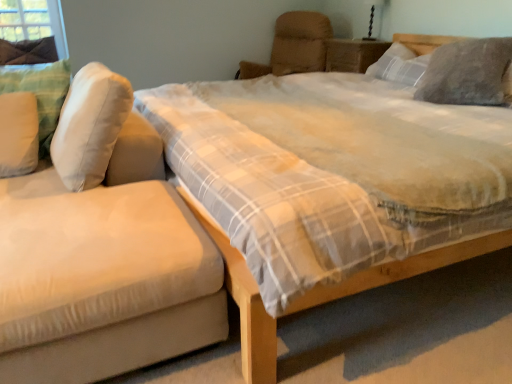
Question: From the image's perspective, is black glass table lamp at upper right positioned above or below gray fuzzy pillow at upper right, the 1th pillow positioned from the right?

Choices:
 (A) below
 (B) above

Answer: (B)

Question: Is black glass table lamp at upper right inside or outside of gray fuzzy pillow at upper right, the 1th pillow positioned from the right?

Choices:
 (A) inside
 (B) outside

Answer: (B)

Question: Which object is positioned farthest from the beige fabric armchair at upper center?

Choices:
 (A) black glass table lamp at upper right
 (B) white soft pillow at left, positioned as the first pillow in left-to-right order
 (C) wooden nightstand at upper center
 (D) white fabric pillow at left, the third pillow from the right
 (E) suede-like beige studio couch at left

Answer: (E)

Question: Which of these objects is positioned farthest from the velvet beige bed at center?

Choices:
 (A) white soft pillow at left, positioned as the first pillow in left-to-right order
 (B) black glass table lamp at upper right
 (C) gray fuzzy pillow at upper right, the 4th pillow from the left
 (D) wooden nightstand at upper center
 (E) suede-like beige studio couch at left

Answer: (B)